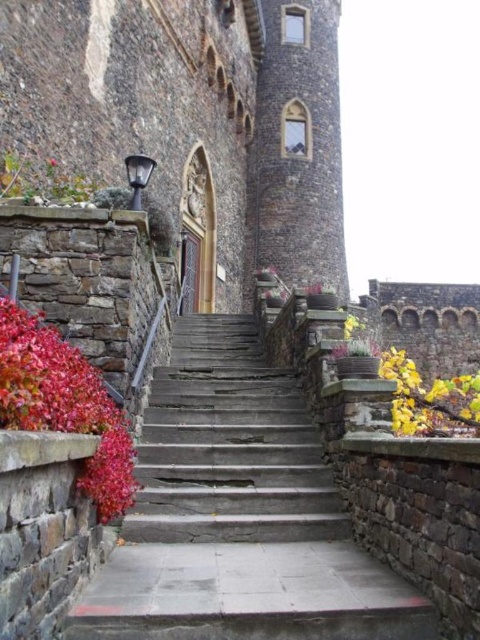
You are an architect inspecting the building from the bottom of the staircase. You notice the dark brown stone tower at upper center and the vivid red leaves at left. Which object is closer to you from your current viewpoint?

The dark brown stone tower at upper center is closer to you than the vivid red leaves at left, so the dark brown stone tower at upper center is closer.

From the picture: You are standing at the bottom of the stone staircase leading to the grand medieval building. You notice a point marked at coordinates (297, 148). What does this point represent?

The point at coordinates (297, 148) represents the dark brown stone tower at upper center.

You are standing at the base of the stone stairs at center. If you were to walk straight ahead, which direction would lead you towards the grand medieval building?

Walking straight ahead from the stone stairs at center would lead you towards the grand medieval building, as the stairs are positioned at the base leading directly up to it.